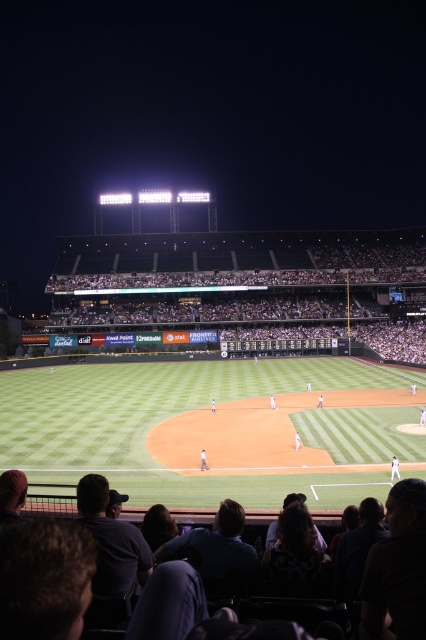
Question: Estimate the real-world distances between objects in this image. Which object is closer to the dark fabric seats at lower center?

Choices:
 (A) white uniform at center
 (B) white fabric baseball player at center
 (C) white fabric shirt at center

Answer: (A)

Question: Does dark fabric seats at lower center have a larger size compared to white fabric shirt at center?

Choices:
 (A) yes
 (B) no

Answer: (B)

Question: Considering the real-world distances, which object is closest to the dark fabric seats at lower center?

Choices:
 (A) white uniform at center
 (B) white fabric baseball player at center
 (C) white fabric shirt at center

Answer: (A)

Question: In this image, where is dark fabric seats at lower center located relative to white fabric baseball player at center?

Choices:
 (A) below
 (B) above

Answer: (B)

Question: Which of the following is the farthest from the observer?

Choices:
 (A) white uniform at center
 (B) dark fabric seats at lower center
 (C) white fabric baseball player at center
 (D) white fabric shirt at center

Answer: (C)

Question: Is white fabric shirt at center positioned in front of white fabric baseball player at center?

Choices:
 (A) no
 (B) yes

Answer: (B)